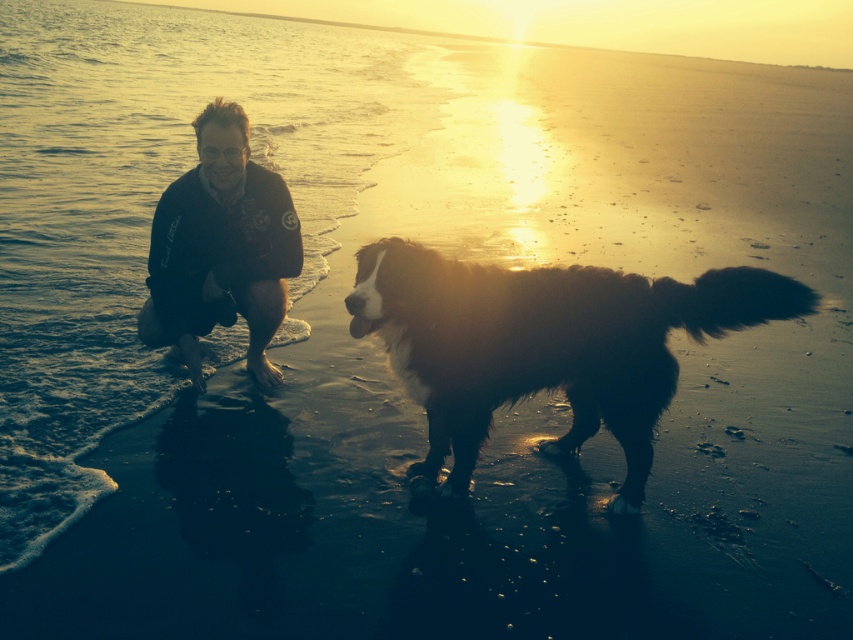
You are a photographer trying to capture a photo of the black shaggy dog at center and the black softshell jacket at left. You want to ensure both subjects are in focus. If your camera has a depth of field range of 30 inches, will you need to adjust your focus to include both?

The black shaggy dog at center is 36.74 inches away from the black softshell jacket at left. Since the distance between them exceeds the camera lens depth of field range of 30 inches, you will need to adjust your focus to ensure both are in focus.

You are a photographer trying to capture the sunset scene. You have a camera bag that can hold items up to the size of the black softshell jacket at left. Can the black shaggy dog at center fit into your camera bag?

The black shaggy dog at center is bigger than the black softshell jacket at left, so it cannot fit into the camera bag designed for items up to the jacket size.

You are standing at the center of the beach scene. A black shaggy dog at center is located at coordinates point 0.539, 0.641. If you want to walk directly towards the dog, which direction should you head?

The black shaggy dog at center is located at point (546,344). Since you are at the center, you should walk towards the coordinates to reach the dog.